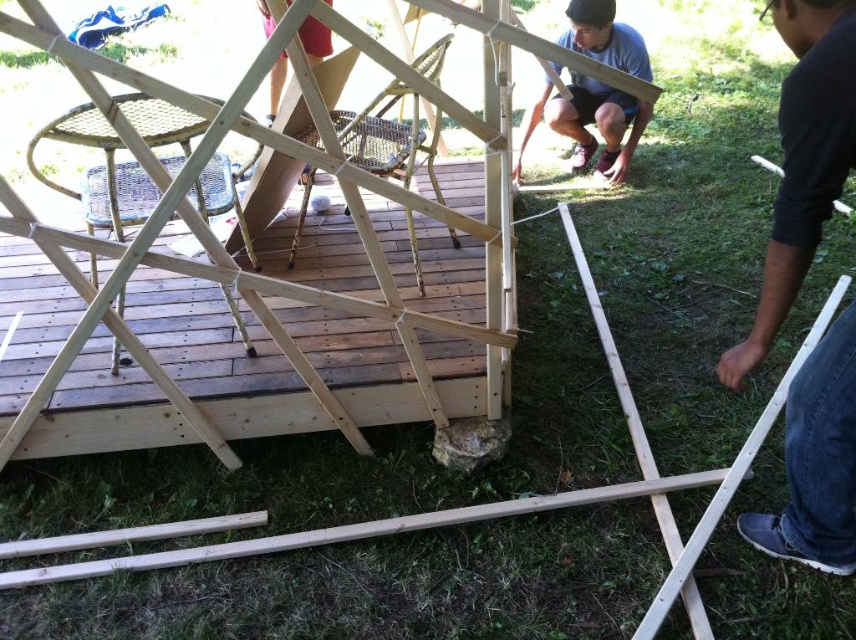
From the picture: You are trying to place a wooden beam on the natural wood deck at center. The beam is as wide as the dark blue jeans at lower right. Will it fit on the deck?

The natural wood deck at center is wider than the dark blue jeans at lower right, so the beam, which is as wide as the dark blue jeans at lower right, will fit on the deck.

You are standing at the edge of the construction site and need to move the natural wood deck at center to the right side. Which direction should you move the matte wood person at center to avoid blocking the path?

You should move the matte wood person at center to the left since the natural wood deck at center is already to the left of the matte wood person at center, so moving the person left would clear the path to the right.

You are trying to determine the spatial relationship between the dark blue jeans at lower right and the matte wood person at center. Which object has a smaller width?

The dark blue jeans at lower right is thinner than matte wood person at center, so the dark blue jeans at lower right has a smaller width.